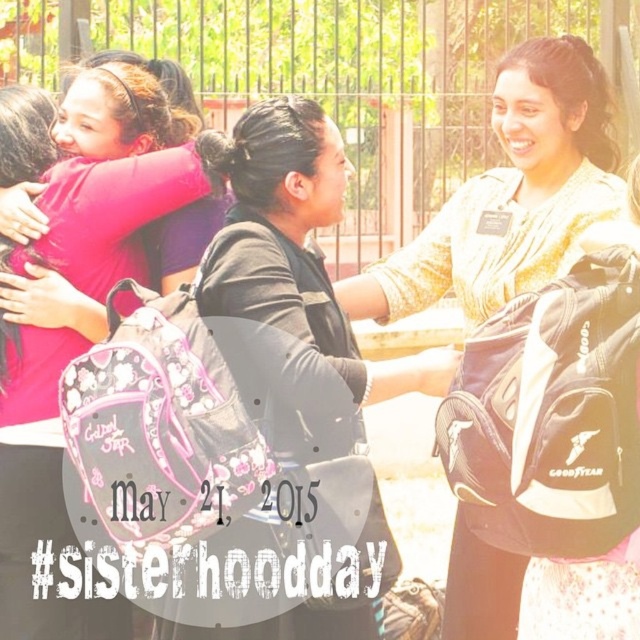
You are standing at the point marked as point [38,488]. What fabric is directly under your feet?

The point [38,488] is on pink fabric at left, so the fabric directly under your feet is pink fabric at left.

You are standing at the center of the scene and need to reach both the matte black backpack at center and the black matte backpack at center. Which backpack is closer to you?

Both the matte black backpack at center and the black matte backpack at center are at the same central position, so they are equally close to you.

From the picture: You are organizing a hiking trip and need to ensure that your backpack is visible to your group. You have two backpacks in your inventory labeled as matte black backpack at center and black matte backpack at center. According to the scene, which backpack is positioned in front and thus more visible to the group?

The matte black backpack at center is positioned in front of the black matte backpack at center, making it more visible to the group.